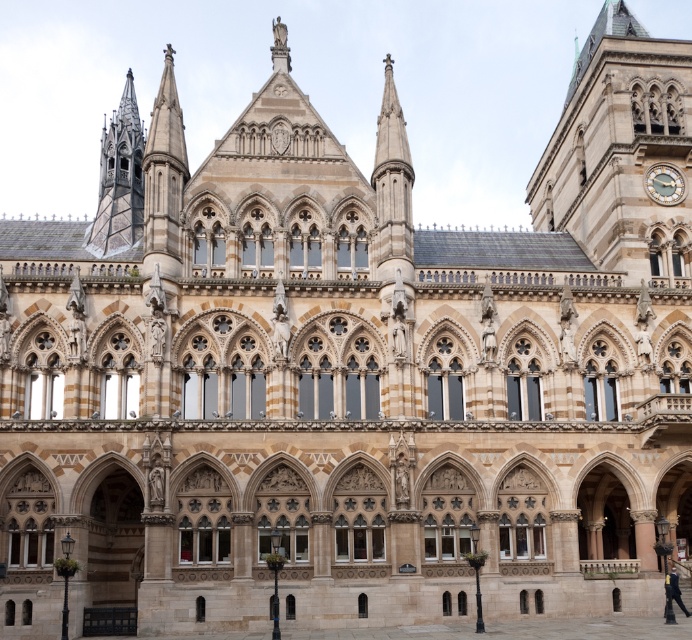
Between golden stone clock tower at upper right and gold metallic clock at upper right, which one has more height?

golden stone clock tower at upper right is taller.

Does point (639, 148) come in front of point (668, 193)?

Yes.

Does point (628, 49) come farther from viewer compared to point (671, 192)?

Yes, point (628, 49) is behind point (671, 192).

This screenshot has width=692, height=640. Identify the location of golden stone clock tower at upper right. (619, 150).

Consider the image. Who is positioned more to the left, golden stone clock tower at upper right or dark blue suit at lower right?

From the viewer's perspective, dark blue suit at lower right appears more on the left side.

Is golden stone clock tower at upper right to the left of dark blue suit at lower right from the viewer's perspective?

No, golden stone clock tower at upper right is not to the left of dark blue suit at lower right.

The image size is (692, 640). Identify the location of golden stone clock tower at upper right. (619, 150).

You are a GUI agent. You are given a task and a screenshot of the screen. Output one action in this format:
    pyautogui.click(x=<x>, y=<y>)
    Task: Click on the golden stone clock tower at upper right
    The height and width of the screenshot is (640, 692).
    Given the screenshot: What is the action you would take?
    pyautogui.click(x=619, y=150)

Who is lower down, gold metallic clock at upper right or dark blue suit at lower right?

dark blue suit at lower right is lower down.

At what (x,y) coordinates should I click in order to perform the action: click on gold metallic clock at upper right. Please return your answer as a coordinate pair (x, y). Looking at the image, I should click on (664, 182).

Between point (662, 176) and point (666, 589), which one is positioned in front?

Positioned in front is point (666, 589).

Locate an element on the screen. gold metallic clock at upper right is located at coordinates (664, 182).